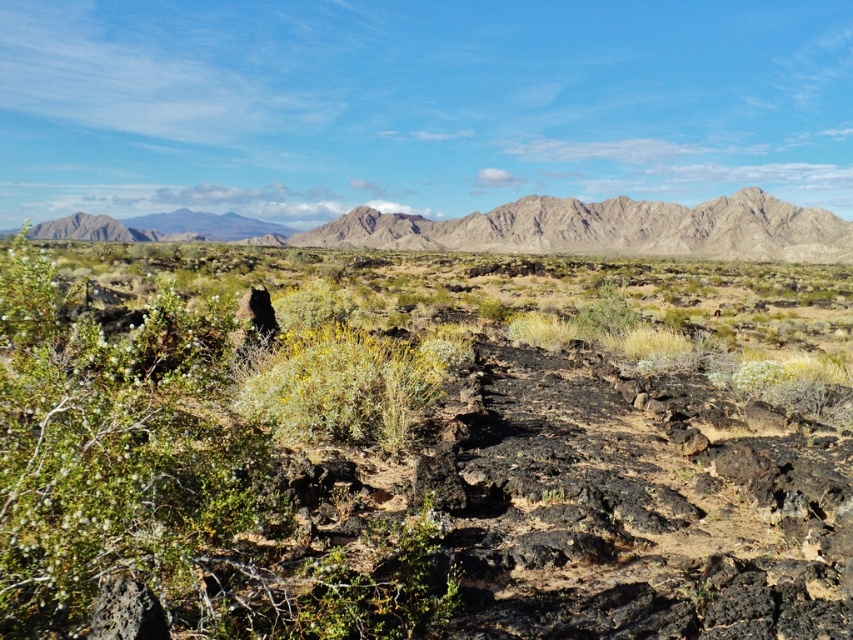
You are standing at the point marked by point (399, 465) in the desert scene. What type of terrain feature are you currently standing on?

The point (399, 465) marks volcanic rock at center, so you are standing on volcanic rock terrain.

You are standing in the desert and see the volcanic rock at center and the rugged rock mountain at center. Which one is taller?

The rugged rock mountain at center is taller than the volcanic rock at center.

You are standing in the desert and see two points marked in the image. Which point is closer to you, point [720,275] or point [520,243]?

Point [720,275] is closer to the viewer than point [520,243].